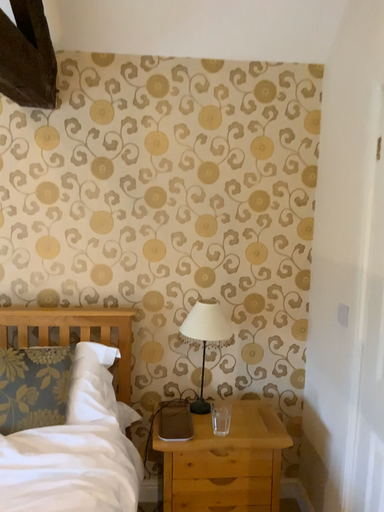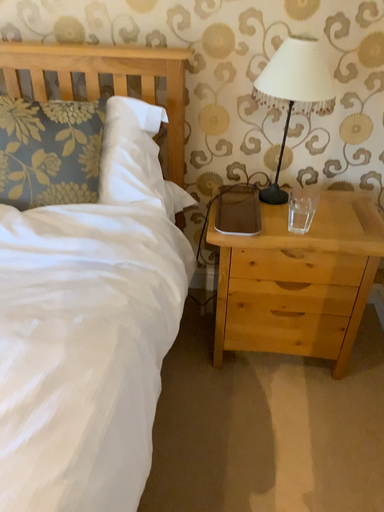
Question: Which way did the camera rotate in the video?

Choices:
 (A) rotated upward
 (B) rotated downward

Answer: (B)